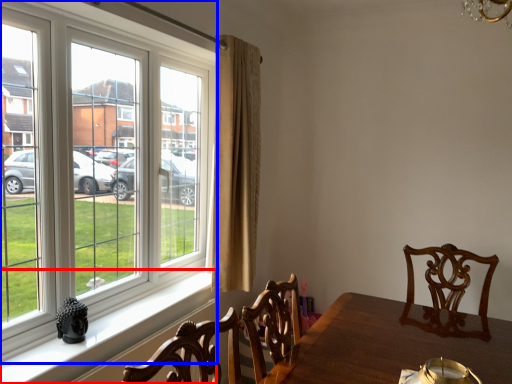
Question: Among these objects, which one is nearest to the camera, window sill (highlighted by a red box) or window (highlighted by a blue box)?

Choices:
 (A) window sill
 (B) window

Answer: (B)